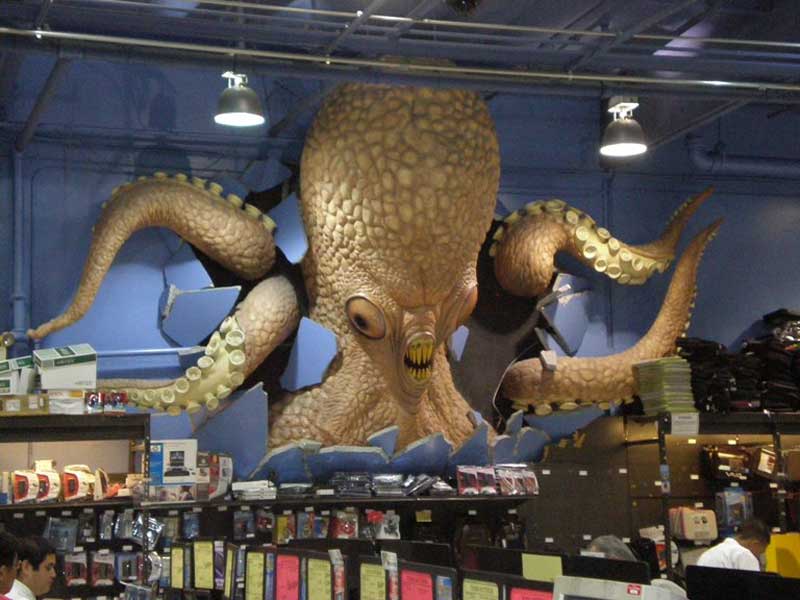
You are a GUI agent. You are given a task and a screenshot of the screen. Output one action in this format:
    pyautogui.click(x=<x>, y=<y>)
    Task: Click on the lights
    
    Given the screenshot: What is the action you would take?
    pyautogui.click(x=245, y=121), pyautogui.click(x=621, y=149)